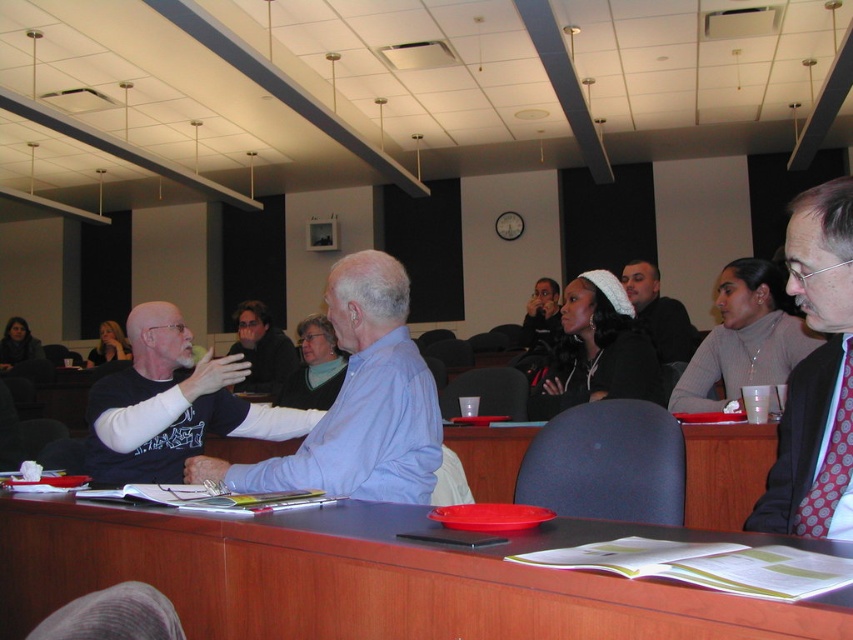
You are a photographer trying to capture a candid shot of the two people at the center of the classroom scene. You want to ensure that both the white knit hat at center and the dark brown hair at center are visible in the frame. Based on their positions, which object should you prioritize framing to the left side of the photo?

The white knit hat at center is to the left of dark brown hair at center, so you should prioritize framing the white knit hat at center on the left side of the photo to capture both subjects properly.